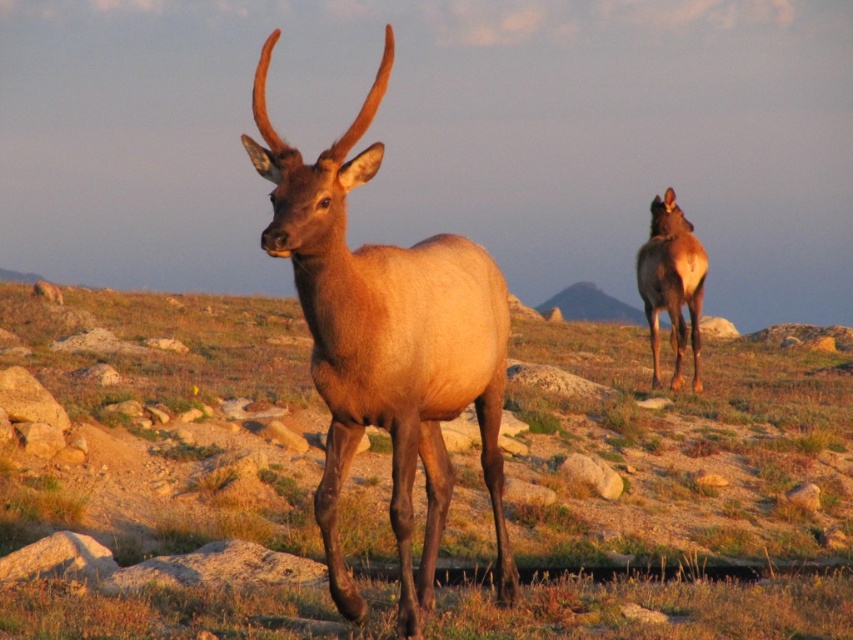
Is point (476, 326) more distant than point (654, 276)?

No, it is not.

Who is lower down, shiny brown deer at center or brown velvet deer at right?

brown velvet deer at right is lower down.

Image resolution: width=853 pixels, height=640 pixels. What are the coordinates of `shiny brown deer at center` in the screenshot? It's located at (387, 344).

From the picture: Is brown matte grass at center shorter than shiny brown deer at center?

Yes, brown matte grass at center is shorter than shiny brown deer at center.

Does brown matte grass at center have a greater width compared to shiny brown deer at center?

Yes, brown matte grass at center is wider than shiny brown deer at center.

What do you see at coordinates (180, 468) in the screenshot?
I see `brown matte grass at center` at bounding box center [180, 468].

Find the location of a particular element. brown matte grass at center is located at coordinates (180, 468).

Who is lower down, brown matte grass at center or brown velvet deer at right?

brown matte grass at center

Does point (618, 448) lie behind point (653, 368)?

No, (618, 448) is in front of (653, 368).

Describe the element at coordinates (180, 468) in the screenshot. This screenshot has height=640, width=853. I see `brown matte grass at center` at that location.

The height and width of the screenshot is (640, 853). In order to click on brown matte grass at center in this screenshot , I will do `click(180, 468)`.